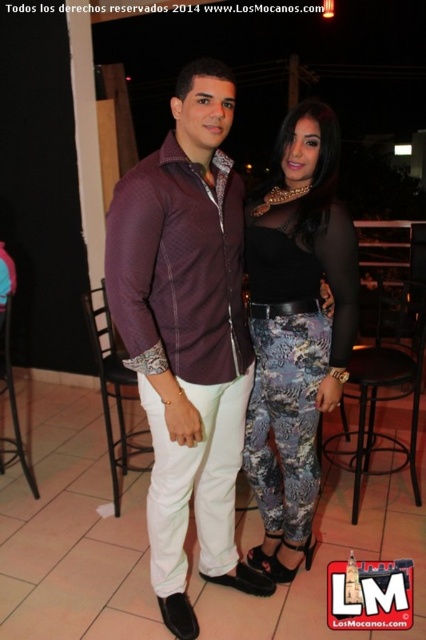
Who is positioned more to the left, matte purple shirt at center or black metal bar stool at lower right?

Positioned to the left is matte purple shirt at center.

Is matte purple shirt at center to the left of black metal bar stool at lower right from the viewer's perspective?

Indeed, matte purple shirt at center is positioned on the left side of black metal bar stool at lower right.

Is point (140, 234) behind point (379, 355)?

No, it is in front of (379, 355).

This screenshot has height=640, width=426. Identify the location of matte purple shirt at center. (187, 336).

Who is more forward, (115, 273) or (273, 573)?

Point (115, 273) is more forward.

Consider the image. Does matte purple shirt at center have a greater height compared to metallic silver pants at center?

Indeed, matte purple shirt at center has a greater height compared to metallic silver pants at center.

Where is `matte purple shirt at center`? The image size is (426, 640). matte purple shirt at center is located at coordinates (187, 336).

Where is `matte purple shirt at center`? The width and height of the screenshot is (426, 640). matte purple shirt at center is located at coordinates (187, 336).

Does metallic silver pants at center appear over black metal bar stool at lower right?

Yes, metallic silver pants at center is above black metal bar stool at lower right.

Between point (261, 444) and point (379, 349), which one is positioned in front?

Point (261, 444) is more forward.

Find the location of a particular element. This screenshot has width=426, height=640. metallic silver pants at center is located at coordinates (296, 330).